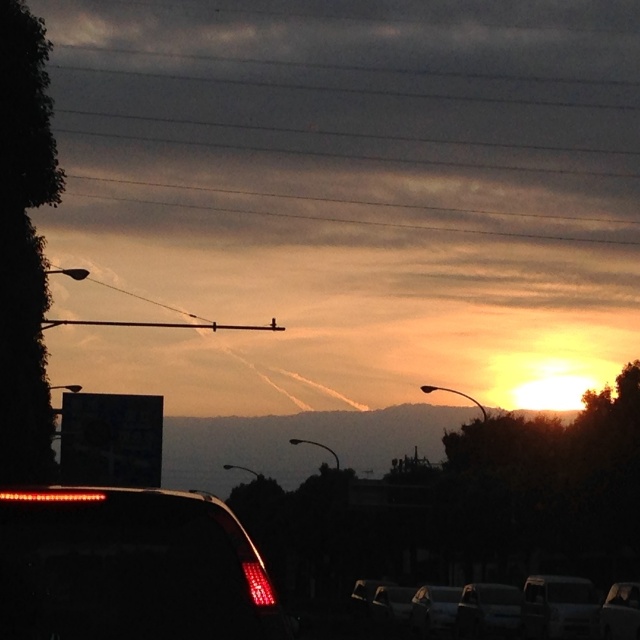
Question: Can you confirm if white matte car at lower center is bigger than matte black car at lower right?

Choices:
 (A) no
 (B) yes

Answer: (B)

Question: Does matte red tail light at lower left have a larger size compared to shiny black car at lower center?

Choices:
 (A) yes
 (B) no

Answer: (B)

Question: Estimate the real-world distances between objects in this image. Which object is farther from the matte red tail light at lower left?

Choices:
 (A) metallic silver car at lower center
 (B) matte black car at lower right
 (C) shiny black car at lower center
 (D) metallic silver car at lower right

Answer: (C)

Question: Can you confirm if metallic silver car at lower center is positioned to the left of metallic silver sedan at center?

Choices:
 (A) yes
 (B) no

Answer: (B)

Question: Which object is closer to the camera taking this photo?

Choices:
 (A) metallic silver car at center
 (B) matte black car at lower right

Answer: (B)

Question: Which object is the closest to the metallic silver car at center?

Choices:
 (A) metallic silver car at lower center
 (B) matte black car at lower right

Answer: (A)